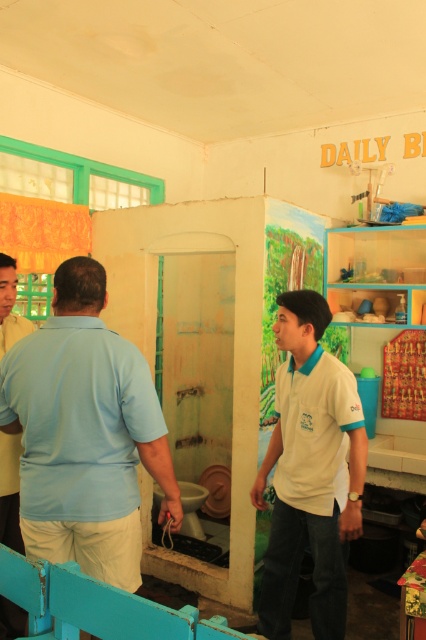
Does light blue cotton shirt at center have a greater height compared to light blue shirt at left?

Yes.

Between point (72, 355) and point (0, 289), which one is positioned behind?

Point (0, 289)

The width and height of the screenshot is (426, 640). I want to click on light blue cotton shirt at center, so click(85, 433).

Based on the photo, which is more to the right, light blue cotton shirt at center or white cotton shirt at center?

From the viewer's perspective, white cotton shirt at center appears more on the right side.

Does light blue cotton shirt at center appear under white cotton shirt at center?

Incorrect, light blue cotton shirt at center is not positioned below white cotton shirt at center.

Which is in front, point (81, 316) or point (262, 579)?

Positioned in front is point (81, 316).

Locate an element on the screen. This screenshot has width=426, height=640. light blue cotton shirt at center is located at coordinates (85, 433).

Does white cotton shirt at center have a larger size compared to light blue shirt at left?

Indeed, white cotton shirt at center has a larger size compared to light blue shirt at left.

Based on the photo, can you confirm if white cotton shirt at center is thinner than light blue shirt at left?

Incorrect, white cotton shirt at center's width is not less than light blue shirt at left's.

Does point (342, 632) come in front of point (19, 451)?

Yes, it is.

The height and width of the screenshot is (640, 426). What are the coordinates of `white cotton shirt at center` in the screenshot? It's located at (310, 472).